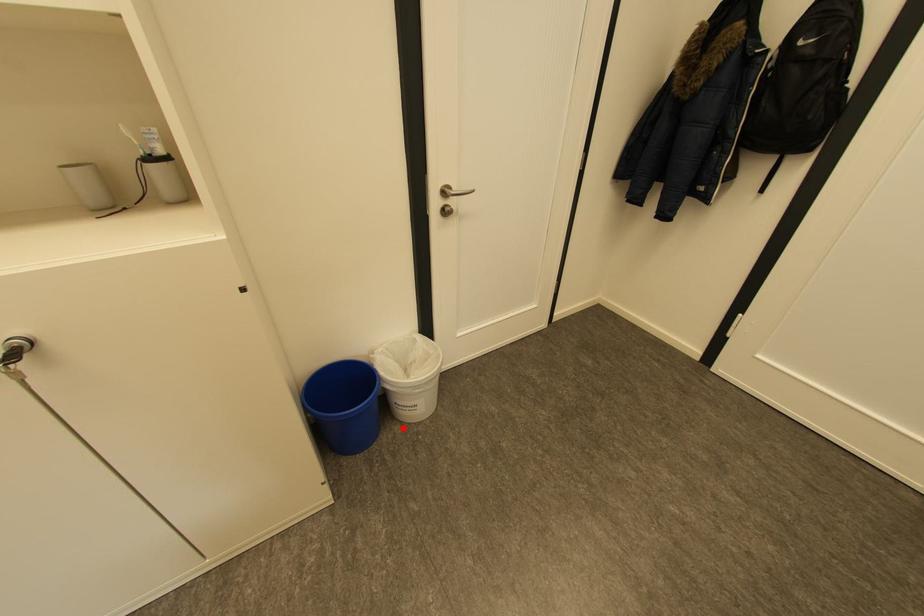
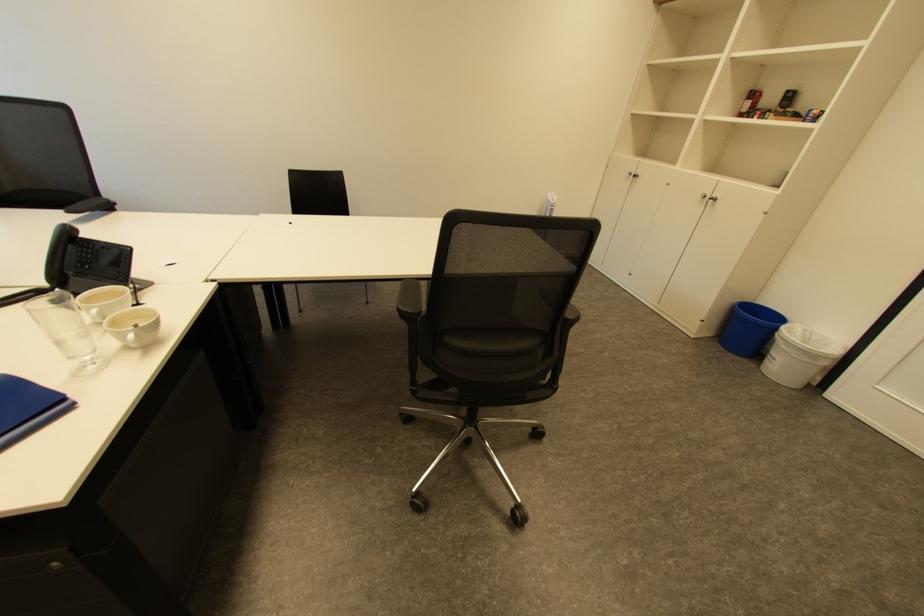
The point at the highlighted location is marked in the first image. Where is the corresponding point in the second image?

(760, 365)